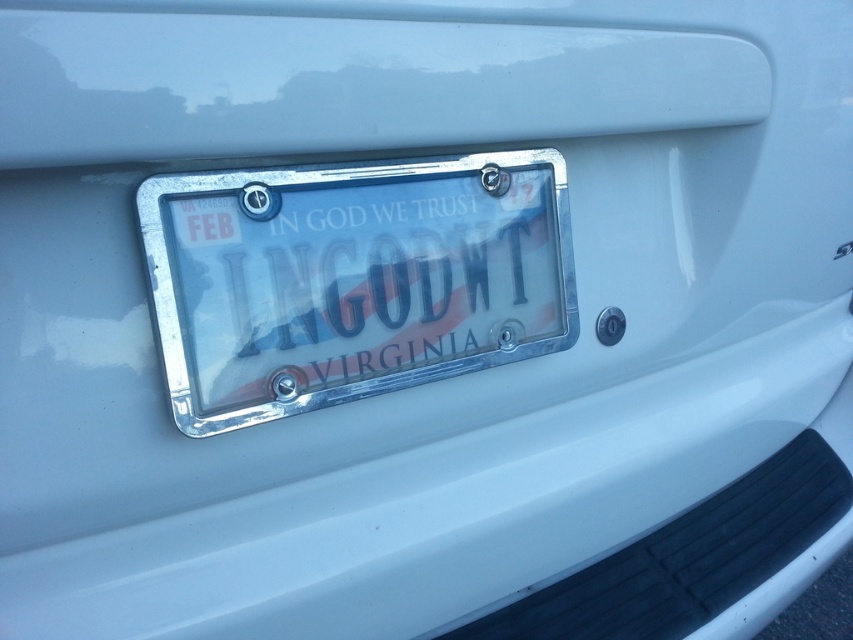
Question: Observing the image, what is the correct spatial positioning of chrome metallic license plate at center in reference to black glossy text at center?

Choices:
 (A) below
 (B) above

Answer: (A)

Question: Among these points, which one is farthest from the camera?

Choices:
 (A) (490, 284)
 (B) (389, 337)

Answer: (A)

Question: Can you confirm if chrome metallic license plate at center is bigger than black glossy text at center?

Choices:
 (A) no
 (B) yes

Answer: (B)

Question: Does chrome metallic license plate at center come in front of black glossy text at center?

Choices:
 (A) no
 (B) yes

Answer: (B)